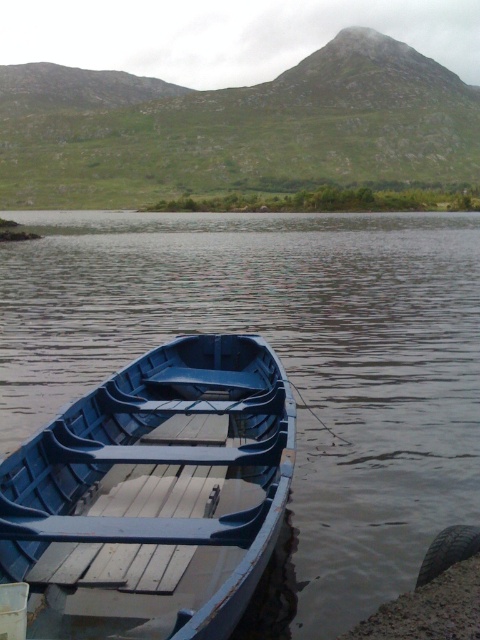
Is blue wood boat at center taller than matte blue boat at lower left?

Correct, blue wood boat at center is much taller as matte blue boat at lower left.

Is point (48, 362) closer to viewer compared to point (216, 339)?

No.

Who is more forward, (317, 524) or (181, 490)?

Point (181, 490)

Image resolution: width=480 pixels, height=640 pixels. Identify the location of blue wood boat at center. (285, 365).